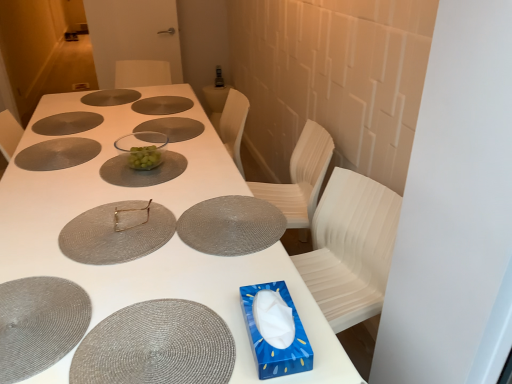
I want to click on vacant area that lies to the right of matte gray glass plate at upper left, the third glass plate in the back-to-front sequence, so point(110,122).